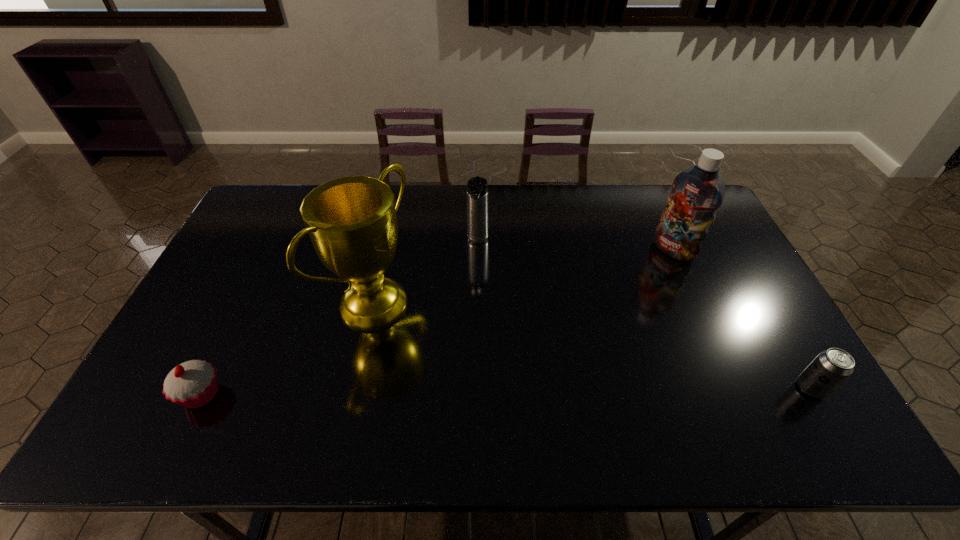
You are a GUI agent. You are given a task and a screenshot of the screen. Output one action in this format:
    pyautogui.click(x=<x>, y=<y>)
    Task: Click on the object that is the fourth closest to the third tallest object
    Image resolution: width=960 pixels, height=540 pixels.
    Given the screenshot: What is the action you would take?
    pyautogui.click(x=831, y=367)

Select which object appears as the second closest to the second object from right to left. Please provide its 2D coordinates. Your answer should be formatted as a tuple, i.e. [(x, y)], where the tuple contains the x and y coordinates of a point satisfying the conditions above.

[(477, 187)]

In order to click on vacant space that satisfies the following two spatial constraints: 1. on the back side of the second object from left to right; 2. on the left side of the shampoo in this screenshot , I will do `click(386, 250)`.